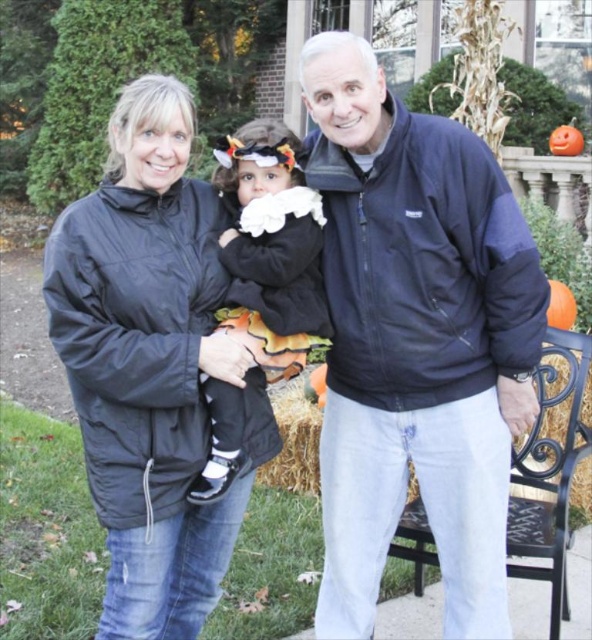
Does point (175, 374) lie in front of point (310, 385)?

Yes.

Does black matte jacket at center have a larger size compared to orange matte pumpkin at center?

Yes, black matte jacket at center is bigger than orange matte pumpkin at center.

Between point (118, 464) and point (317, 369), which one is positioned in front?

Point (118, 464) is in front.

Identify the location of black matte jacket at center. This screenshot has width=592, height=640. (152, 364).

Between point (152, 164) and point (555, 324), which one is positioned in front?

Point (152, 164)

Describe the element at coordinates (152, 364) in the screenshot. I see `black matte jacket at center` at that location.

This screenshot has height=640, width=592. Find the location of `black matte jacket at center`. black matte jacket at center is located at coordinates (152, 364).

Is point (329, 358) closer to viewer compared to point (552, 326)?

Yes.

Is navy blue jacket at center positioned in front of orange matte pumpkin at right?

Yes, navy blue jacket at center is in front of orange matte pumpkin at right.

The width and height of the screenshot is (592, 640). Describe the element at coordinates (416, 340) in the screenshot. I see `navy blue jacket at center` at that location.

This screenshot has width=592, height=640. Find the location of `navy blue jacket at center`. navy blue jacket at center is located at coordinates (416, 340).